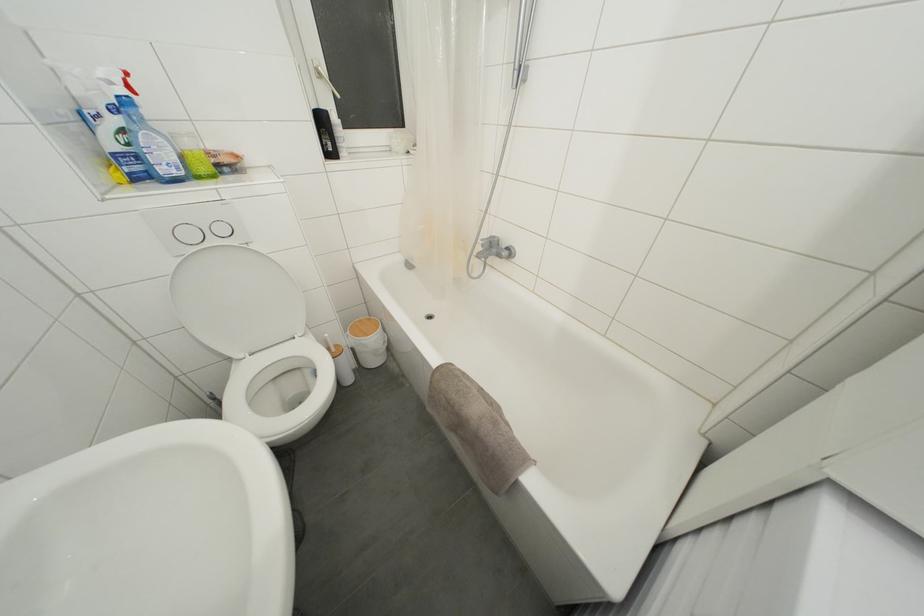
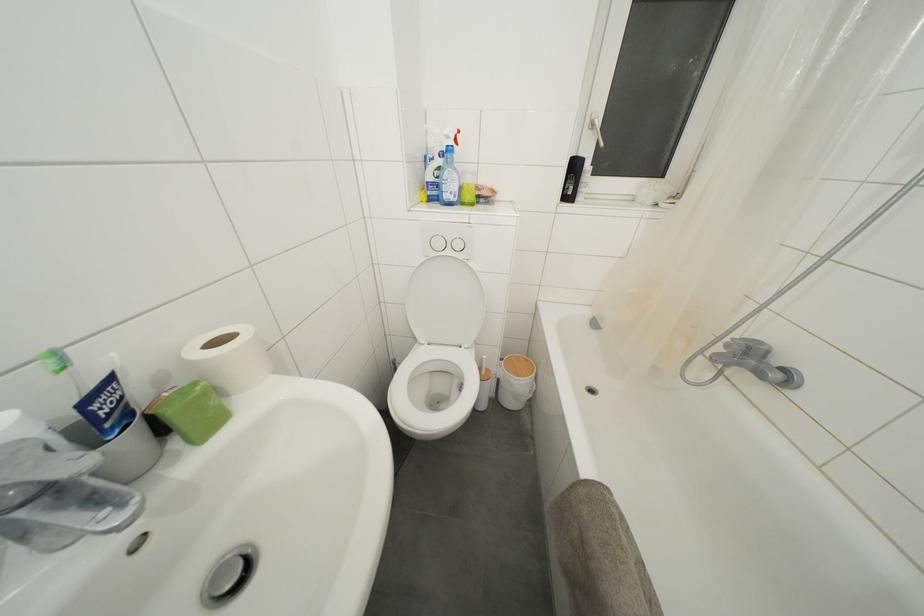
Question: Based on the continuous images, in which direction is the camera rotating? Reply with the corresponding letter.

Choices:
 (A) Left
 (B) Right
 (C) Up
 (D) Down

Answer: (A)